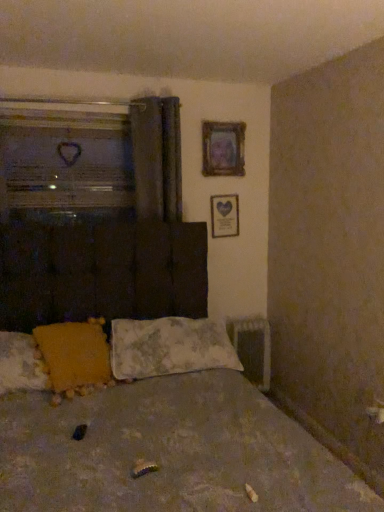
Measure the distance between transparent glass heart at upper left and camera.

transparent glass heart at upper left is 8.49 feet from camera.

This screenshot has height=512, width=384. What do you see at coordinates (64, 161) in the screenshot? I see `transparent glass heart at upper left` at bounding box center [64, 161].

Describe the element at coordinates (74, 356) in the screenshot. I see `yellow fabric pillow at lower left, which is the 2th pillow in right-to-left order` at that location.

In the scene shown: How much space does yellow fabric pillow at lower left, which is the 2th pillow in right-to-left order, occupy horizontally?

yellow fabric pillow at lower left, which is the 2th pillow in right-to-left order, is 15.49 inches wide.

Identify the location of wooden frame at upper center, the first picture frame positioned from the top. (223, 148).

How much space does wooden heart-shaped frame at upper right, the first picture frame ordered from the bottom, occupy vertically?

The height of wooden heart-shaped frame at upper right, the first picture frame ordered from the bottom, is 12.82 inches.

This screenshot has width=384, height=512. What are the coordinates of `dark gray fabric curtain at upper center` in the screenshot? It's located at (157, 157).

From the image's perspective, is textured fabric bed at center below wooden heart-shaped frame at upper right, which appears as the 2th picture frame when viewed from the top?

Yes.

Is textured fabric bed at center at the left side of wooden heart-shaped frame at upper right, the first picture frame ordered from the bottom?

Indeed, textured fabric bed at center is positioned on the left side of wooden heart-shaped frame at upper right, the first picture frame ordered from the bottom.

Considering the relative sizes of textured fabric bed at center and wooden heart-shaped frame at upper right, which appears as the 2th picture frame when viewed from the top, in the image provided, is textured fabric bed at center thinner than wooden heart-shaped frame at upper right, which appears as the 2th picture frame when viewed from the top,?

No, textured fabric bed at center is not thinner than wooden heart-shaped frame at upper right, which appears as the 2th picture frame when viewed from the top.

Is point (68, 462) behind point (211, 217)?

No.

From the image's perspective, is fluffy white pillow at center, the 1th pillow positioned from the right, beneath wooden frame at upper center, the first picture frame positioned from the top?

Correct, fluffy white pillow at center, the 1th pillow positioned from the right, appears lower than wooden frame at upper center, the first picture frame positioned from the top, in the image.

What's the angular difference between fluffy white pillow at center, which is counted as the 2th pillow, starting from the left, and wooden frame at upper center, arranged as the 2th picture frame when ordered from the bottom,'s facing directions?

1.85 degrees separate the facing orientations of fluffy white pillow at center, which is counted as the 2th pillow, starting from the left, and wooden frame at upper center, arranged as the 2th picture frame when ordered from the bottom.

From a real-world perspective, which object rests below the other?

From a 3D spatial view, fluffy white pillow at center, the 1th pillow positioned from the right, is below.

Is fluffy white pillow at center, which is counted as the 2th pillow, starting from the left, to the left of wooden frame at upper center, the first picture frame positioned from the top, from the viewer's perspective?

Correct, you'll find fluffy white pillow at center, which is counted as the 2th pillow, starting from the left, to the left of wooden frame at upper center, the first picture frame positioned from the top.

Choose the correct answer: Is wooden heart-shaped frame at upper right, the first picture frame ordered from the bottom, inside dark gray fabric curtain at upper center or outside it?

wooden heart-shaped frame at upper right, the first picture frame ordered from the bottom, is not enclosed by dark gray fabric curtain at upper center.

Is wooden heart-shaped frame at upper right, the first picture frame ordered from the bottom, positioned with its back to dark gray fabric curtain at upper center?

That's not correct — wooden heart-shaped frame at upper right, the first picture frame ordered from the bottom, is not looking away from dark gray fabric curtain at upper center.

From a real-world perspective, is wooden heart-shaped frame at upper right, which appears as the 2th picture frame when viewed from the top, physically located above or below dark gray fabric curtain at upper center?

In terms of real-world spatial position, wooden heart-shaped frame at upper right, which appears as the 2th picture frame when viewed from the top, is below dark gray fabric curtain at upper center.

Which object is thinner, fluffy white pillow at center, which is counted as the 2th pillow, starting from the left, or yellow fabric pillow at lower left, which is the 2th pillow in right-to-left order?

With smaller width is yellow fabric pillow at lower left, which is the 2th pillow in right-to-left order.

Is fluffy white pillow at center, which is counted as the 2th pillow, starting from the left, facing towards yellow fabric pillow at lower left, which is counted as the first pillow, starting from the left?

No, fluffy white pillow at center, which is counted as the 2th pillow, starting from the left, is not turned towards yellow fabric pillow at lower left, which is counted as the first pillow, starting from the left.

Looking at this image, considering the relative sizes of fluffy white pillow at center, which is counted as the 2th pillow, starting from the left, and yellow fabric pillow at lower left, which is the 2th pillow in right-to-left order, in the image provided, is fluffy white pillow at center, which is counted as the 2th pillow, starting from the left, smaller than yellow fabric pillow at lower left, which is the 2th pillow in right-to-left order,?

No.

From the image's perspective, which one is positioned lower, fluffy white pillow at center, the 1th pillow positioned from the right, or yellow fabric pillow at lower left, which is the 2th pillow in right-to-left order?

From the image's view, fluffy white pillow at center, the 1th pillow positioned from the right, is below.

Does wooden frame at upper center, arranged as the 2th picture frame when ordered from the bottom, turn towards transparent glass heart at upper left?

No.

Is wooden frame at upper center, the first picture frame positioned from the top, far from transparent glass heart at upper left?

No, there isn't a large distance between wooden frame at upper center, the first picture frame positioned from the top, and transparent glass heart at upper left.

Considering the sizes of objects wooden frame at upper center, arranged as the 2th picture frame when ordered from the bottom, and transparent glass heart at upper left in the image provided, who is thinner, wooden frame at upper center, arranged as the 2th picture frame when ordered from the bottom, or transparent glass heart at upper left?

wooden frame at upper center, arranged as the 2th picture frame when ordered from the bottom.

Based on the photo, from the image's perspective, is wooden frame at upper center, arranged as the 2th picture frame when ordered from the bottom, under transparent glass heart at upper left?

No, from the image's perspective, wooden frame at upper center, arranged as the 2th picture frame when ordered from the bottom, is not below transparent glass heart at upper left.

In the scene shown: Considering the sizes of wooden frame at upper center, arranged as the 2th picture frame when ordered from the bottom, and wooden heart-shaped frame at upper right, the first picture frame ordered from the bottom, in the image, is wooden frame at upper center, arranged as the 2th picture frame when ordered from the bottom, wider or thinner than wooden heart-shaped frame at upper right, the first picture frame ordered from the bottom,?

In the image, wooden frame at upper center, arranged as the 2th picture frame when ordered from the bottom, appears to be wider than wooden heart-shaped frame at upper right, the first picture frame ordered from the bottom.

From the image's perspective, does wooden frame at upper center, the first picture frame positioned from the top, appear lower than wooden heart-shaped frame at upper right, the first picture frame ordered from the bottom?

No, from the image's perspective, wooden frame at upper center, the first picture frame positioned from the top, is not beneath wooden heart-shaped frame at upper right, the first picture frame ordered from the bottom.

Considering the positions of objects wooden frame at upper center, the first picture frame positioned from the top, and wooden heart-shaped frame at upper right, the first picture frame ordered from the bottom, in the image provided, who is more to the left, wooden frame at upper center, the first picture frame positioned from the top, or wooden heart-shaped frame at upper right, the first picture frame ordered from the bottom,?

wooden frame at upper center, the first picture frame positioned from the top.

Does wooden frame at upper center, arranged as the 2th picture frame when ordered from the bottom, have a lesser height compared to wooden heart-shaped frame at upper right, the first picture frame ordered from the bottom?

No.

Is textured fabric bed at center not inside yellow fabric pillow at lower left, which is the 2th pillow in right-to-left order?

That's correct, textured fabric bed at center is outside of yellow fabric pillow at lower left, which is the 2th pillow in right-to-left order.

Considering the sizes of objects textured fabric bed at center and yellow fabric pillow at lower left, which is the 2th pillow in right-to-left order, in the image provided, who is bigger, textured fabric bed at center or yellow fabric pillow at lower left, which is the 2th pillow in right-to-left order,?

With larger size is textured fabric bed at center.

What's the angular difference between textured fabric bed at center and yellow fabric pillow at lower left, which is the 2th pillow in right-to-left order,'s facing directions?

17.7 degrees separate the facing orientations of textured fabric bed at center and yellow fabric pillow at lower left, which is the 2th pillow in right-to-left order.

Can you confirm if textured fabric bed at center is positioned to the left of yellow fabric pillow at lower left, which is counted as the first pillow, starting from the left?

No, textured fabric bed at center is not to the left of yellow fabric pillow at lower left, which is counted as the first pillow, starting from the left.

You are a GUI agent. You are given a task and a screenshot of the screen. Output one action in this format:
    pyautogui.click(x=<x>, y=<y>)
    Task: Click on the 1st picture frame positioned above the textured fabric bed at center (from the image's perspective)
    The height and width of the screenshot is (512, 384).
    Given the screenshot: What is the action you would take?
    pyautogui.click(x=224, y=215)

What are the coordinates of `the 2nd pillow directly beneath the wooden frame at upper center, the first picture frame positioned from the top (from a real-world perspective)` in the screenshot? It's located at (169, 347).

From the image, which object appears to be farther from wooden frame at upper center, the first picture frame positioned from the top, transparent glass heart at upper left or dark gray fabric curtain at upper center?

Among the two, transparent glass heart at upper left is located further to wooden frame at upper center, the first picture frame positioned from the top.

Which object lies further to the anchor point transparent glass heart at upper left, wooden heart-shaped frame at upper right, which appears as the 2th picture frame when viewed from the top, or dark gray fabric curtain at upper center?

wooden heart-shaped frame at upper right, which appears as the 2th picture frame when viewed from the top.

Estimate the real-world distances between objects in this image. Which object is closer to dark gray fabric curtain at upper center, fluffy white pillow at center, the 1th pillow positioned from the right, or yellow fabric pillow at lower left, which is counted as the first pillow, starting from the left?

fluffy white pillow at center, the 1th pillow positioned from the right, is closer to dark gray fabric curtain at upper center.

Looking at the image, which one is located further to wooden heart-shaped frame at upper right, the first picture frame ordered from the bottom, fluffy white pillow at center, the 1th pillow positioned from the right, or textured fabric bed at center?

Based on the image, textured fabric bed at center appears to be further to wooden heart-shaped frame at upper right, the first picture frame ordered from the bottom.

Based on their spatial positions, is fluffy white pillow at center, which is counted as the 2th pillow, starting from the left, or textured fabric bed at center further from dark gray fabric curtain at upper center?

→ Based on the image, textured fabric bed at center appears to be further to dark gray fabric curtain at upper center.

Which object lies nearer to the anchor point yellow fabric pillow at lower left, which is the 2th pillow in right-to-left order, transparent glass heart at upper left or wooden heart-shaped frame at upper right, which appears as the 2th picture frame when viewed from the top?

The object closer to yellow fabric pillow at lower left, which is the 2th pillow in right-to-left order, is transparent glass heart at upper left.

Looking at the image, which one is located closer to textured fabric bed at center, wooden heart-shaped frame at upper right, which appears as the 2th picture frame when viewed from the top, or yellow fabric pillow at lower left, which is the 2th pillow in right-to-left order?

yellow fabric pillow at lower left, which is the 2th pillow in right-to-left order.

From the image, which object appears to be nearer to transparent glass heart at upper left, wooden heart-shaped frame at upper right, the first picture frame ordered from the bottom, or textured fabric bed at center?

Among the two, wooden heart-shaped frame at upper right, the first picture frame ordered from the bottom, is located nearer to transparent glass heart at upper left.

At what (x,y) coordinates should I click in order to perform the action: click on pillow that lies between dark gray fabric curtain at upper center and fluffy white pillow at center, which is counted as the 2th pillow, starting from the left, from top to bottom. Please return your answer as a coordinate pair (x, y). This screenshot has height=512, width=384. Looking at the image, I should click on (74, 356).

This screenshot has height=512, width=384. I want to click on picture frame between dark gray fabric curtain at upper center and fluffy white pillow at center, which is counted as the 2th pillow, starting from the left, from top to bottom, so click(224, 215).

Identify the location of picture frame between dark gray fabric curtain at upper center and wooden heart-shaped frame at upper right, which appears as the 2th picture frame when viewed from the top. (223, 148).

This screenshot has height=512, width=384. Find the location of `window between textured fabric bed at center and wooden frame at upper center, the first picture frame positioned from the top, from front to back`. window between textured fabric bed at center and wooden frame at upper center, the first picture frame positioned from the top, from front to back is located at coordinates (64, 161).